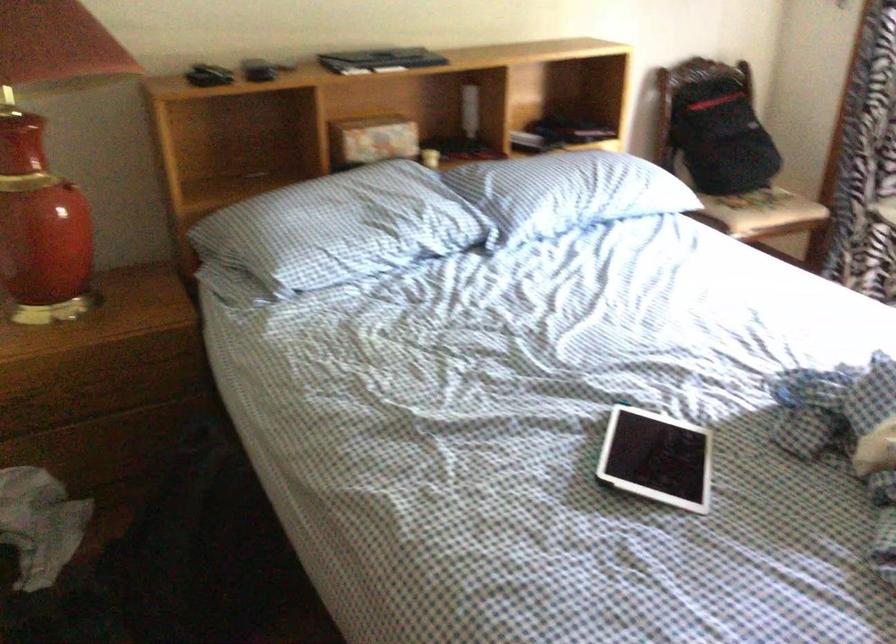
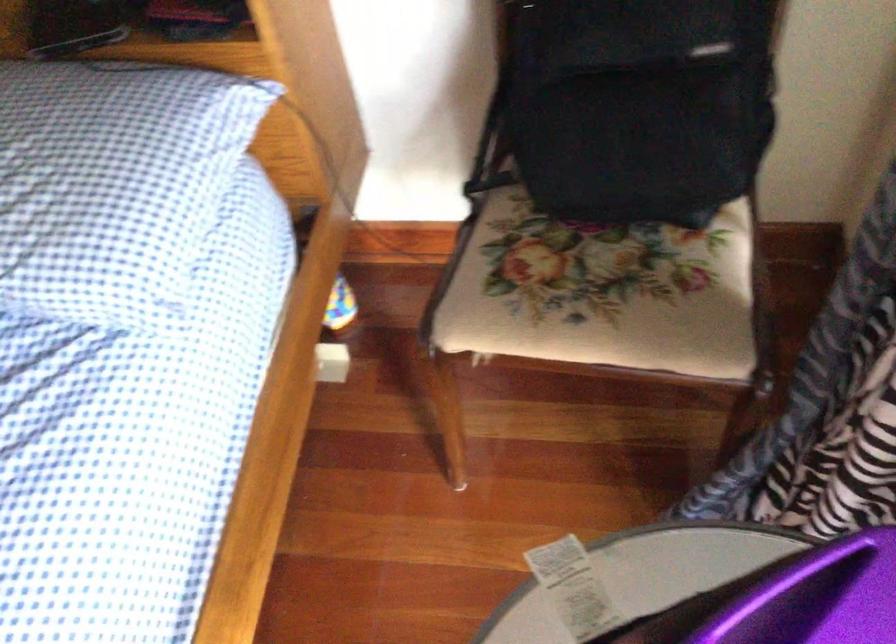
The point at (755,128) is marked in the first image. Where is the corresponding point in the second image?

(639, 104)